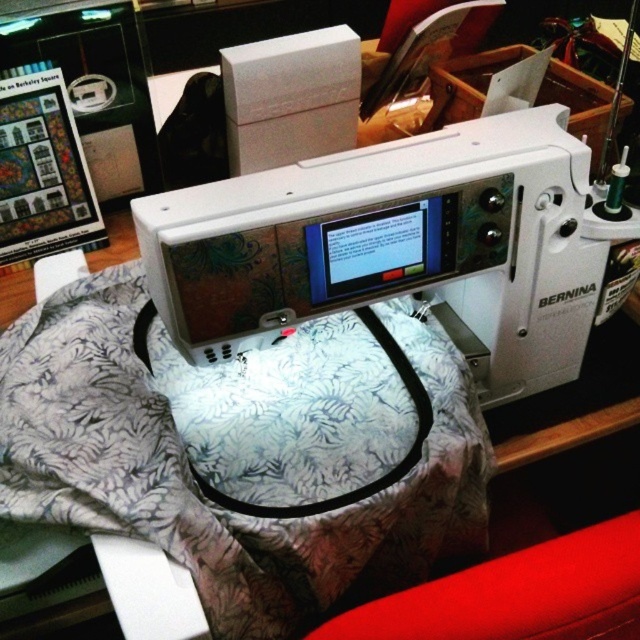
Can you confirm if white floral fabric at center is positioned below red fabric at lower right?

No.

How distant is white floral fabric at center from red fabric at lower right?

A distance of 10.81 inches exists between white floral fabric at center and red fabric at lower right.

The height and width of the screenshot is (640, 640). Identify the location of white floral fabric at center. (241, 451).

Can you confirm if white floral fabric at center is smaller than white plastic sewing machine at center?

Incorrect, white floral fabric at center is not smaller in size than white plastic sewing machine at center.

Does white floral fabric at center appear over white plastic sewing machine at center?

Actually, white floral fabric at center is below white plastic sewing machine at center.

Which is in front, point (355, 385) or point (536, 182)?

Point (536, 182)

The height and width of the screenshot is (640, 640). Identify the location of white floral fabric at center. (241, 451).

Which is above, white plastic sewing machine at center or red fabric at lower right?

Positioned higher is white plastic sewing machine at center.

Can you confirm if white plastic sewing machine at center is thinner than red fabric at lower right?

In fact, white plastic sewing machine at center might be wider than red fabric at lower right.

Is point (365, 262) closer to viewer compared to point (403, 595)?

That is False.

The height and width of the screenshot is (640, 640). In order to click on white plastic sewing machine at center in this screenshot , I will do `click(403, 248)`.